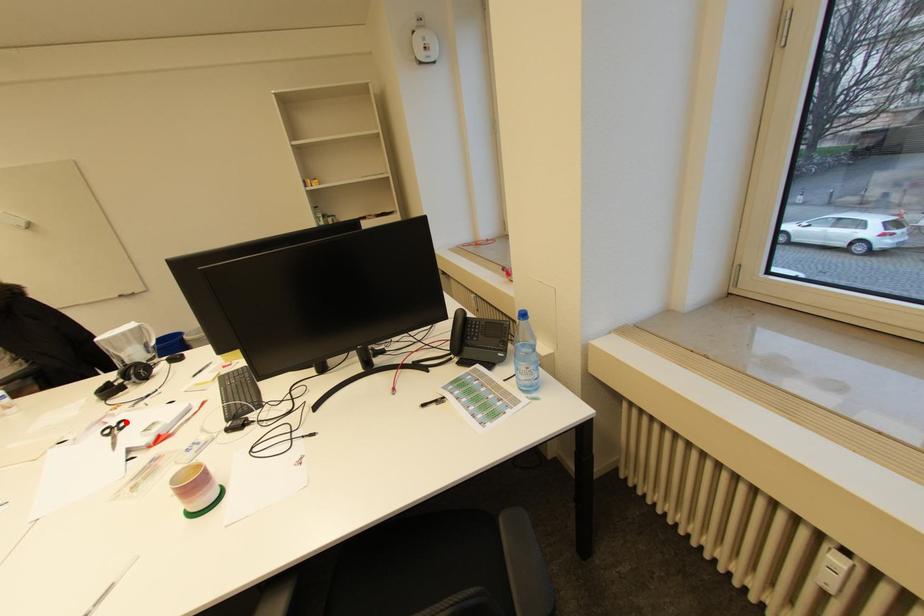
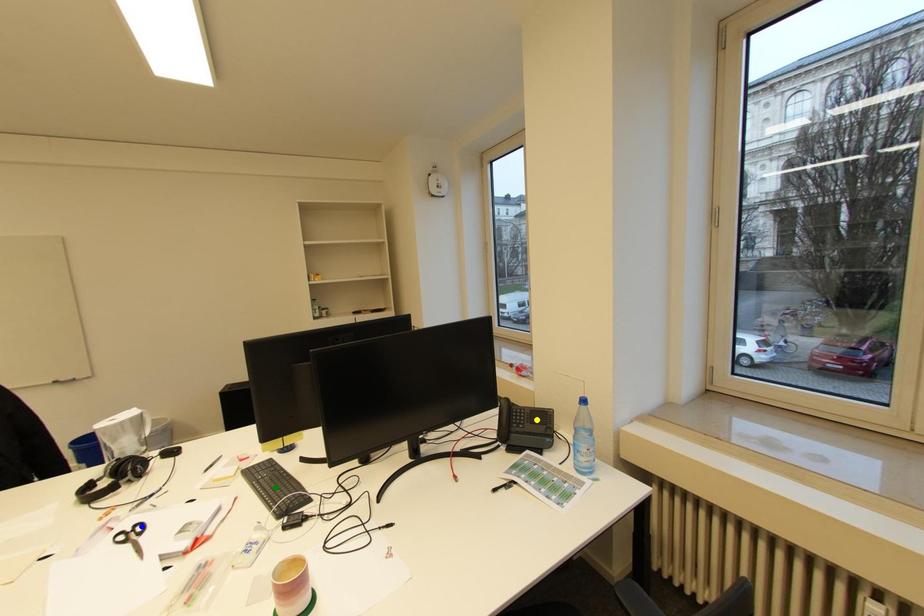
Question: I am providing you with two images of the same scene from different viewpoints. A red point is marked on the first image. You are given multiple points on the second image. Which point in image 2 represents the same 3d spot as the red point in image 1?

Choices:
 (A) blue point
 (B) yellow point
 (C) green point

Answer: (A)